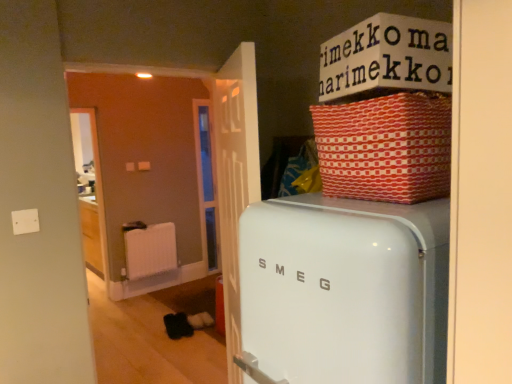
What is the approximate height of white glossy refrigerator at center?

It is 86.81 centimeters.

What is the approximate width of white cardboard box at upper center?

The width of white cardboard box at upper center is 13.48 inches.

The height and width of the screenshot is (384, 512). What do you see at coordinates (150, 250) in the screenshot?
I see `white plastic radiator at center` at bounding box center [150, 250].

The height and width of the screenshot is (384, 512). I want to click on white glossy refrigerator at center, so click(344, 291).

The height and width of the screenshot is (384, 512). I want to click on crate that is on the right side of white glossy refrigerator at center, so click(x=385, y=147).

Does red woven basket at upper right have a greater width compared to white glossy refrigerator at center?

No, red woven basket at upper right is not wider than white glossy refrigerator at center.

Are red woven basket at upper right and white glossy refrigerator at center making contact?

No, red woven basket at upper right is not next to white glossy refrigerator at center.

Does point (351, 119) lie in front of point (358, 366)?

That is False.

Is white plastic radiator at center facing away from white cardboard box at upper center?

That's not correct — white plastic radiator at center is not looking away from white cardboard box at upper center.

Which object is further away from the camera, white plastic radiator at center or white cardboard box at upper center?

white plastic radiator at center is more distant.

From the image's perspective, is white plastic radiator at center under white cardboard box at upper center?

Indeed, from the image's perspective, white plastic radiator at center is shown beneath white cardboard box at upper center.

How different are the orientations of white cardboard box at upper center and white plastic radiator at center in degrees?

The angular difference between white cardboard box at upper center and white plastic radiator at center is 104 degrees.

Which object is positioned more to the left, white cardboard box at upper center or white plastic radiator at center?

Positioned to the left is white plastic radiator at center.

Would you say white cardboard box at upper center contains white plastic radiator at center?

No, white plastic radiator at center is located outside of white cardboard box at upper center.

Based on their positions, is white plastic radiator at center located to the left or right of red woven basket at upper right?

white plastic radiator at center is positioned on red woven basket at upper right's left side.

How much distance is there between white plastic radiator at center and red woven basket at upper right?

white plastic radiator at center is 3.68 meters away from red woven basket at upper right.

Considering the sizes of objects white plastic radiator at center and red woven basket at upper right in the image provided, who is thinner, white plastic radiator at center or red woven basket at upper right?

With smaller width is white plastic radiator at center.

Looking at the image, does white plastic radiator at center seem bigger or smaller compared to red woven basket at upper right?

Considering their sizes, white plastic radiator at center takes up less space than red woven basket at upper right.

In the image, is white plastic radiator at center positioned in front of or behind white glossy refrigerator at center?

Clearly, white plastic radiator at center is behind white glossy refrigerator at center.

Is the surface of white plastic radiator at center in direct contact with white glossy refrigerator at center?

No.

Considering the sizes of white plastic radiator at center and white glossy refrigerator at center in the image, is white plastic radiator at center taller or shorter than white glossy refrigerator at center?

white plastic radiator at center is shorter than white glossy refrigerator at center.

Is red woven basket at upper right bigger than white plastic radiator at center?

Correct, red woven basket at upper right is larger in size than white plastic radiator at center.

This screenshot has width=512, height=384. What are the coordinates of `crate above the white plastic radiator at center (from a real-world perspective)` in the screenshot? It's located at (385, 147).

Who is taller, red woven basket at upper right or white plastic radiator at center?

white plastic radiator at center is taller.

Considering the relative sizes of red woven basket at upper right and white cardboard box at upper center in the image provided, is red woven basket at upper right taller than white cardboard box at upper center?

Yes.

Can you confirm if red woven basket at upper right is thinner than white cardboard box at upper center?

Incorrect, the width of red woven basket at upper right is not less than that of white cardboard box at upper center.

In the scene shown: Can you see red woven basket at upper right touching white cardboard box at upper center?

No, red woven basket at upper right is not beside white cardboard box at upper center.

You are a GUI agent. You are given a task and a screenshot of the screen. Output one action in this format:
    pyautogui.click(x=<x>, y=<y>)
    Task: Click on the home appliance located in front of the red woven basket at upper right
    Image resolution: width=512 pixels, height=384 pixels.
    Given the screenshot: What is the action you would take?
    pyautogui.click(x=344, y=291)

Find the location of a particular element. The image size is (512, 384). radiator below the white cardboard box at upper center (from the image's perspective) is located at coordinates (150, 250).

Considering their positions, is white cardboard box at upper center positioned further to white plastic radiator at center than white glossy refrigerator at center?

white cardboard box at upper center.

Estimate the real-world distances between objects in this image. Which object is further from red woven basket at upper right, white plastic radiator at center or white cardboard box at upper center?

The object further to red woven basket at upper right is white plastic radiator at center.

From the picture: Which object lies further to the anchor point white plastic radiator at center, white glossy refrigerator at center or red woven basket at upper right?

red woven basket at upper right is positioned further to the anchor white plastic radiator at center.

From the picture: Based on their spatial positions, is white plastic radiator at center or red woven basket at upper right closer to white cardboard box at upper center?

red woven basket at upper right is positioned closer to the anchor white cardboard box at upper center.

When comparing their distances from white plastic radiator at center, does red woven basket at upper right or white cardboard box at upper center seem closer?

white cardboard box at upper center.

Which object lies further to the anchor point white cardboard box at upper center, white glossy refrigerator at center or red woven basket at upper right?

white glossy refrigerator at center.

Looking at the image, which one is located closer to white glossy refrigerator at center, white plastic radiator at center or red woven basket at upper right?

red woven basket at upper right.

Considering their positions, is white cardboard box at upper center positioned further to white glossy refrigerator at center than red woven basket at upper right?

white cardboard box at upper center.

The height and width of the screenshot is (384, 512). Identify the location of cardboard box located between red woven basket at upper right and white plastic radiator at center in the depth direction. (386, 57).

Where is `crate between white glossy refrigerator at center and white plastic radiator at center from front to back`? crate between white glossy refrigerator at center and white plastic radiator at center from front to back is located at coordinates (385, 147).

Find the location of a particular element. This screenshot has height=384, width=512. cardboard box between white glossy refrigerator at center and white plastic radiator at center along the z-axis is located at coordinates (386, 57).

Locate an element on the screen. This screenshot has height=384, width=512. crate between white cardboard box at upper center and white glossy refrigerator at center in the vertical direction is located at coordinates (385, 147).